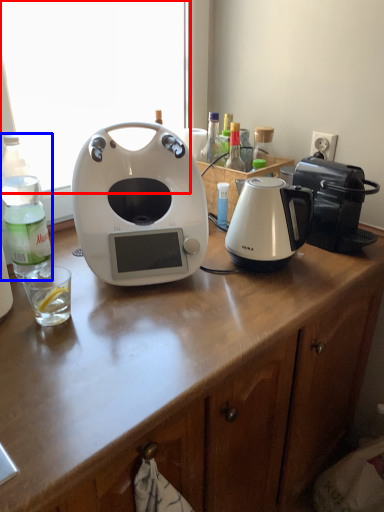
Question: Which object appears closest to the camera in this image, window screen (highlighted by a red box) or bottle (highlighted by a blue box)?

Choices:
 (A) window screen
 (B) bottle

Answer: (B)